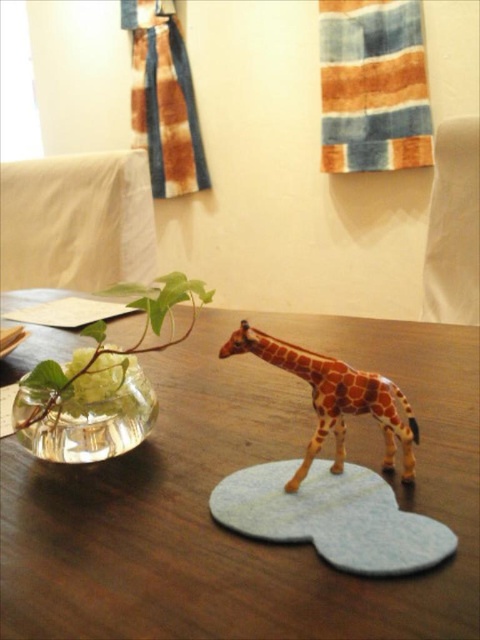
You are looking at the image and want to know which of the two points, point (14, 593) or point (392, 412), is closer to you. Can you determine this based on the scene?

Point (14, 593) is closer to the camera than point (392, 412).

You are arranging a small figurine on a table. The brown wooden table at center is your workspace. You have an orange spotted plastic giraffe at center to place. Considering their sizes, will the giraffe fit entirely on the table?

The brown wooden table at center is bigger than the orange spotted plastic giraffe at center, so yes, the orange spotted plastic giraffe at center will fit entirely on the brown wooden table at center.